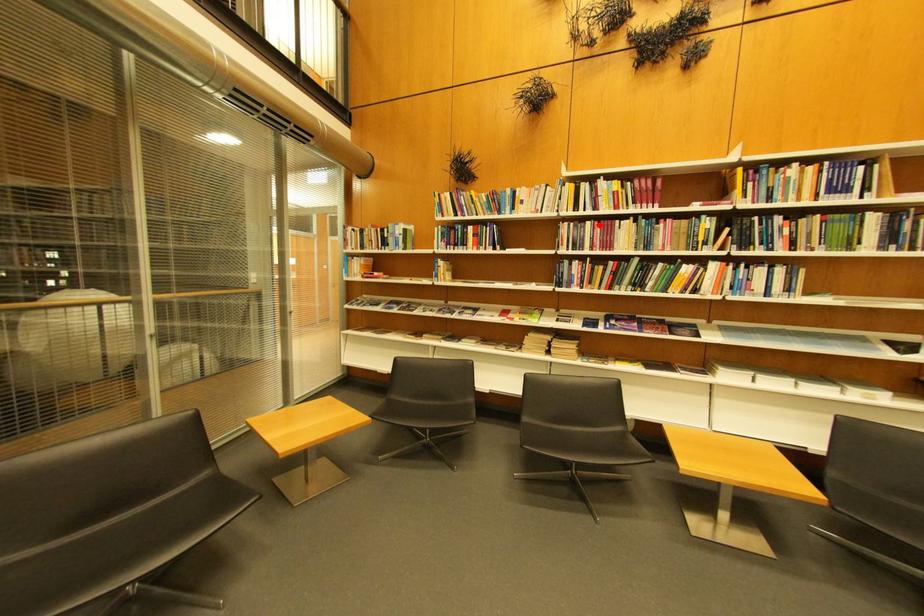
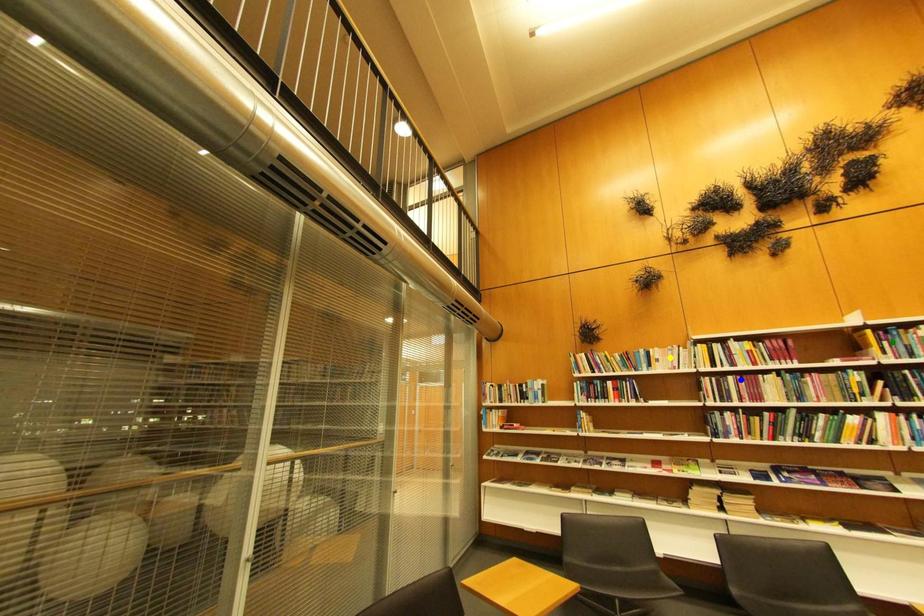
Question: I am providing you with two images of the same scene from different viewpoints. A red point is marked on the first image. You are given multiple points on the second image. In image 2, which mark is for the same physical point as the one in image 1?

Choices:
 (A) yellow point
 (B) green point
 (C) blue point

Answer: (C)